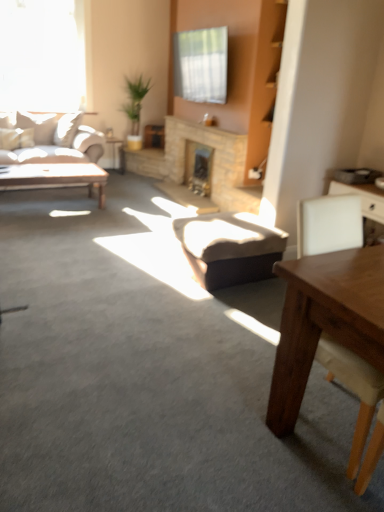
Question: Is matte wooden coffee table at left taller than matte black side table at left?

Choices:
 (A) no
 (B) yes

Answer: (A)

Question: From a real-world perspective, is matte wooden coffee table at left below matte black side table at left?

Choices:
 (A) no
 (B) yes

Answer: (B)

Question: Is matte wooden coffee table at left facing towards matte black side table at left?

Choices:
 (A) yes
 (B) no

Answer: (B)

Question: Is matte wooden coffee table at left outside matte black side table at left?

Choices:
 (A) yes
 (B) no

Answer: (A)

Question: Can matte black side table at left be found inside matte wooden coffee table at left?

Choices:
 (A) yes
 (B) no

Answer: (B)

Question: In the image, is natural stone fireplace at center, acting as the first fireplace starting from the front, positioned in front of or behind matte black side table at left?

Choices:
 (A) front
 (B) behind

Answer: (A)

Question: From the image's perspective, is natural stone fireplace at center, the second fireplace when ordered from back to front, located above or below matte black side table at left?

Choices:
 (A) above
 (B) below

Answer: (B)

Question: From a real-world perspective, relative to matte black side table at left, is natural stone fireplace at center, the second fireplace when ordered from back to front, vertically above or below?

Choices:
 (A) above
 (B) below

Answer: (A)

Question: Considering the positions of point (178, 163) and point (110, 138), is point (178, 163) closer or farther from the camera than point (110, 138)?

Choices:
 (A) closer
 (B) farther

Answer: (A)

Question: Considering the positions of matte black side table at left and matte wooden coffee table at left in the image, is matte black side table at left bigger or smaller than matte wooden coffee table at left?

Choices:
 (A) small
 (B) big

Answer: (A)

Question: From a real-world perspective, relative to matte wooden coffee table at left, is matte black side table at left vertically above or below?

Choices:
 (A) above
 (B) below

Answer: (A)

Question: From the image's perspective, relative to matte wooden coffee table at left, is matte black side table at left above or below?

Choices:
 (A) below
 (B) above

Answer: (B)

Question: Based on their positions, is matte black side table at left located to the left or right of matte wooden coffee table at left?

Choices:
 (A) left
 (B) right

Answer: (B)

Question: In terms of width, does dark brown leather stool at center look wider or thinner when compared to transparent glass window at upper left?

Choices:
 (A) wide
 (B) thin

Answer: (A)

Question: In terms of height, does dark brown leather stool at center look taller or shorter compared to transparent glass window at upper left?

Choices:
 (A) short
 (B) tall

Answer: (A)